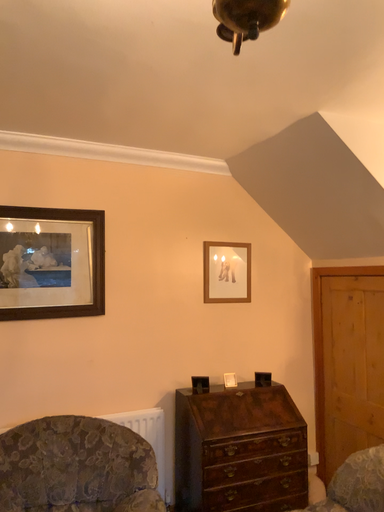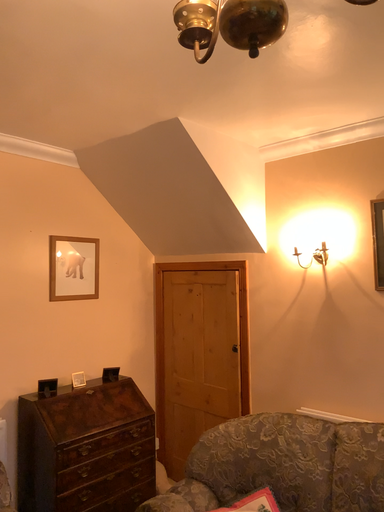
Question: Which way did the camera rotate in the video?

Choices:
 (A) rotated right
 (B) rotated left

Answer: (A)